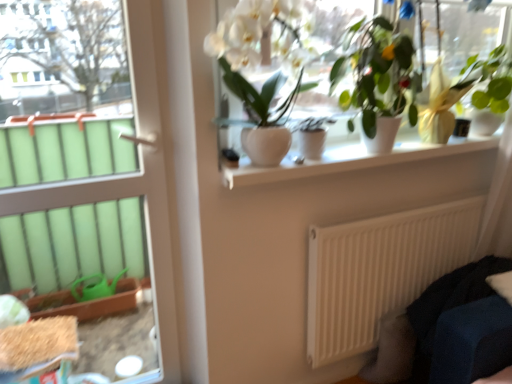
Question: Does point (180, 375) appear closer or farther from the camera than point (314, 135)?

Choices:
 (A) farther
 (B) closer

Answer: (A)

Question: From a real-world perspective, is white glossy door at left above or below matte white pot at center, the second houseplant in the left-to-right sequence?

Choices:
 (A) above
 (B) below

Answer: (B)

Question: Which is nearer to the dark blue fabric couch at lower right?

Choices:
 (A) white glossy window sill at upper center
 (B) white glossy door at left
 (C) green matte plant at upper center, placed as the third houseplant when sorted from left to right
 (D) white matte radiator at lower right
 (E) white glossy vase at upper center, the first houseplant when ordered from left to right

Answer: (D)

Question: Estimate the real-world distances between objects in this image. Which object is closer to the matte white pot at center, the second houseplant in the left-to-right sequence?

Choices:
 (A) white glossy window sill at upper center
 (B) white glossy door at left
 (C) white matte radiator at lower right
 (D) green glossy plant at upper right, arranged as the first houseplant when viewed from the right
 (E) dark blue fabric couch at lower right

Answer: (A)